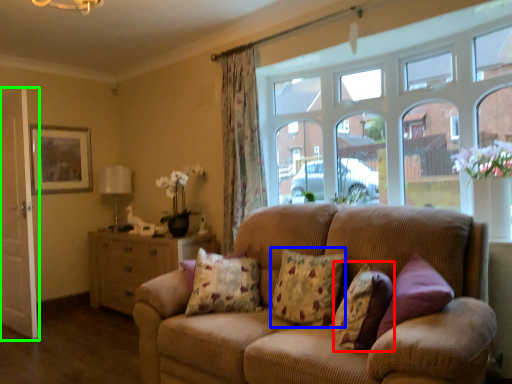
Question: Estimate the real-world distances between objects in this image. Which object is farther from pillow (highlighted by a red box), pillow (highlighted by a blue box) or screen door (highlighted by a green box)?

Choices:
 (A) pillow
 (B) screen door

Answer: (B)